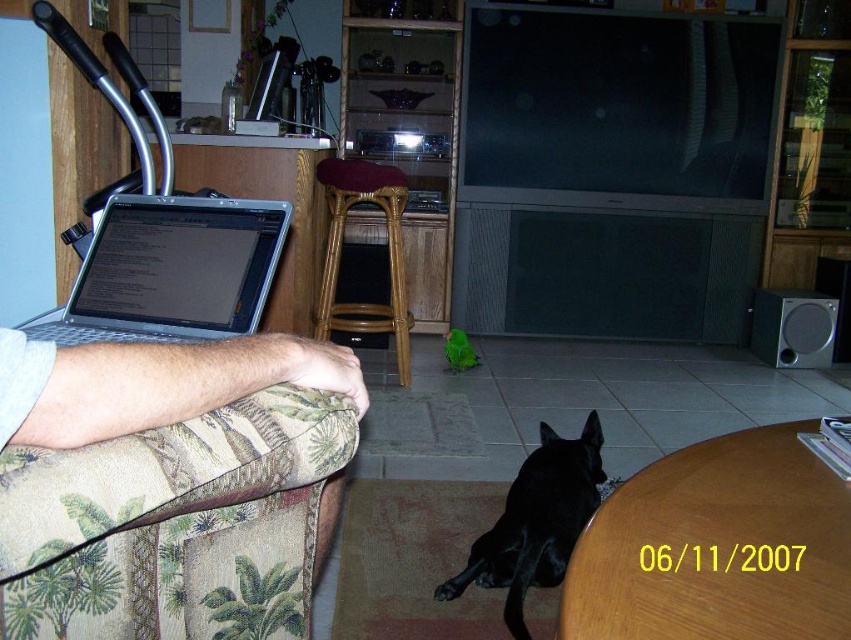
You are standing in the living room and see two points marked in the image. Which point is closer to you, point (341, 435) or point (513, 609)?

Point (341, 435) is in front of point (513, 609), so it is closer to you.

You are a photographer standing in the living room. You want to take a photo of the green fabric couch at lower left without the light skin toneskinhand at lower left appearing in the shot. Is it possible?

Yes, since the light skin toneskinhand at lower left is behind the green fabric couch at lower left, you can position yourself so that the couch blocks the hand from view.